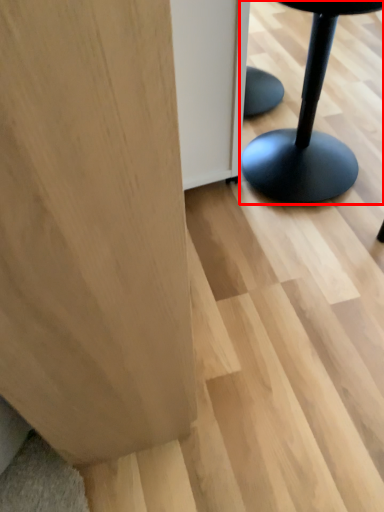
Question: From the image's perspective, where is furniture (annotated by the red box) located in relation to plywood in the image?

Choices:
 (A) above
 (B) below

Answer: (A)